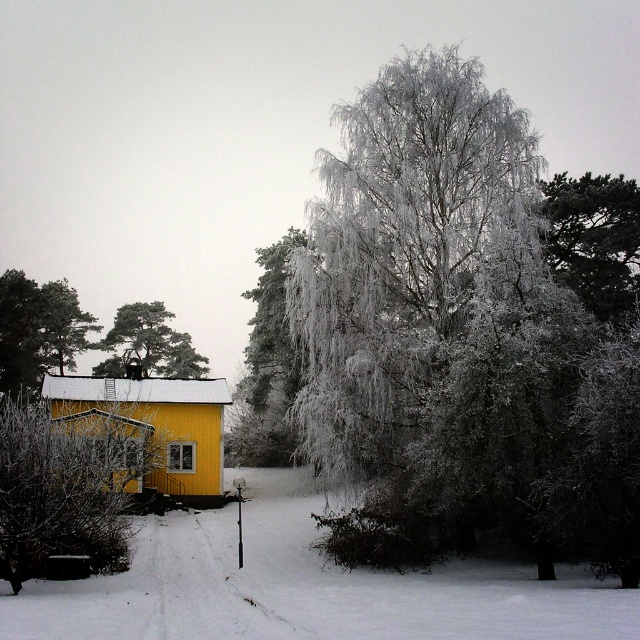
Which is behind, point (220, 429) or point (40, 291)?

Positioned behind is point (40, 291).

Which is more to the left, yellow matte house at lower left or smooth brown tree trunk at left?

smooth brown tree trunk at left

Where is `yellow matte house at lower left`? The width and height of the screenshot is (640, 640). yellow matte house at lower left is located at coordinates (157, 424).

Does yellow matte house at lower left appear over dark green textured pine tree at upper right?

Actually, yellow matte house at lower left is below dark green textured pine tree at upper right.

Which is in front, point (216, 400) or point (611, 221)?

Positioned in front is point (611, 221).

Locate an element on the screen. This screenshot has width=640, height=640. yellow matte house at lower left is located at coordinates (157, 424).

Is yellow matte house at lower left positioned behind snow-covered pine tree at upper left?

That is False.

Can you confirm if yellow matte house at lower left is positioned to the right of snow-covered pine tree at upper left?

Yes, yellow matte house at lower left is to the right of snow-covered pine tree at upper left.

Is point (104, 387) farther from viewer compared to point (168, 371)?

No.

Find the location of a particular element. yellow matte house at lower left is located at coordinates (157, 424).